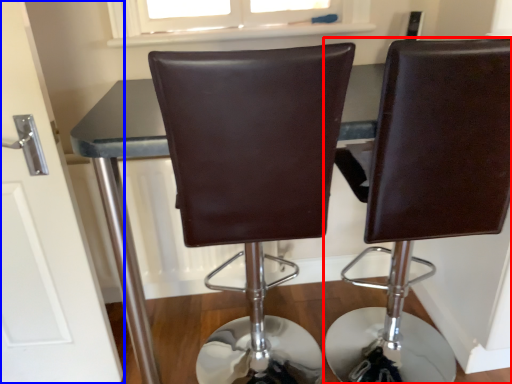
Question: Which of the following is the farthest to the observer, chair (highlighted by a red box) or door (highlighted by a blue box)?

Choices:
 (A) chair
 (B) door

Answer: (B)